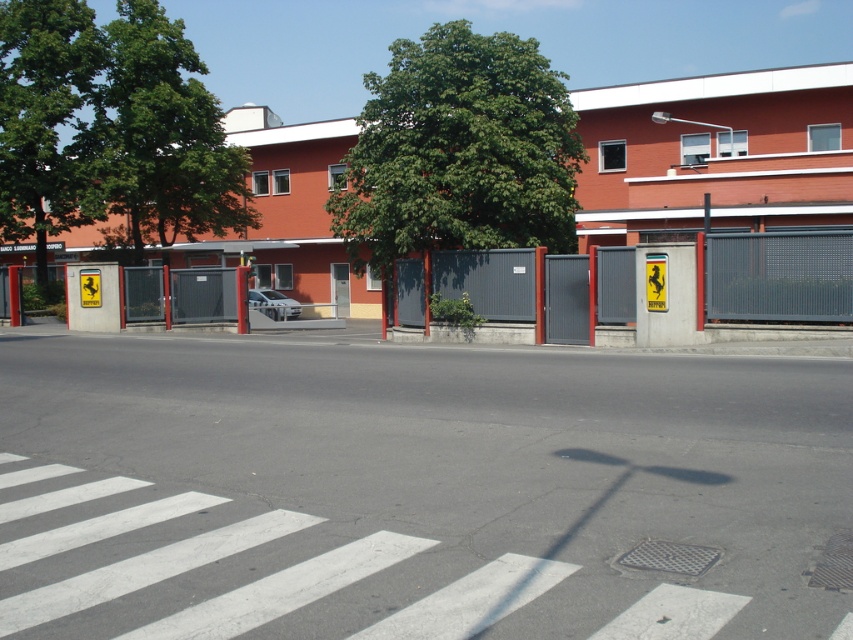
Does white asphalt at center have a greater height compared to white glossy car at center?

Yes, white asphalt at center is taller than white glossy car at center.

Who is more forward, (30, 369) or (282, 320)?

Point (30, 369) is more forward.

Is point (529, 451) farther from viewer compared to point (273, 314)?

No.

The height and width of the screenshot is (640, 853). Identify the location of white asphalt at center. (412, 490).

Looking at this image, who is positioned more to the left, white glossy car at center or metallic pole at center?

white glossy car at center is more to the left.

How much distance is there between white glossy car at center and metallic pole at center?

white glossy car at center and metallic pole at center are 14.92 meters apart.

Who is more distant from viewer, (289,316) or (430,280)?

Positioned behind is point (289,316).

Identify the location of white glossy car at center. (273, 304).

Who is more distant from viewer, (x=820, y=456) or (x=73, y=3)?

Positioned behind is point (x=73, y=3).

Does point (503, 560) come in front of point (74, 0)?

Yes, it is in front of point (74, 0).

Where is `white asphalt at center`? The height and width of the screenshot is (640, 853). white asphalt at center is located at coordinates (412, 490).